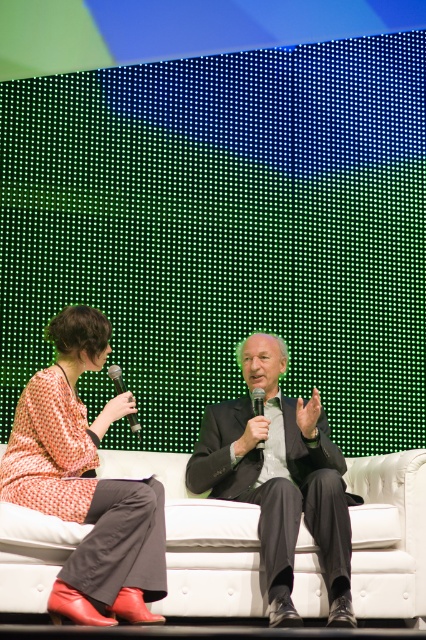
Question: Is metallic silver microphone at center in front of black matte microphone at center?

Choices:
 (A) yes
 (B) no

Answer: (A)

Question: Can you confirm if matte orange dress at center is positioned above black matte microphone at center?

Choices:
 (A) no
 (B) yes

Answer: (A)

Question: Based on their relative distances, which object is farther from the matte black suit at center?

Choices:
 (A) metallic silver microphone at center
 (B) matte orange dress at center
 (C) white fabric couch at center
 (D) black matte microphone at center

Answer: (A)

Question: Is white fabric couch at center to the left of matte black suit at center from the viewer's perspective?

Choices:
 (A) no
 (B) yes

Answer: (A)

Question: Which point is farther from the camera taking this photo?

Choices:
 (A) (172, 609)
 (B) (291, 516)
 (C) (37, 426)

Answer: (C)

Question: Which of the following is the farthest from the observer?

Choices:
 (A) (256, 448)
 (B) (120, 376)
 (C) (62, 310)

Answer: (A)